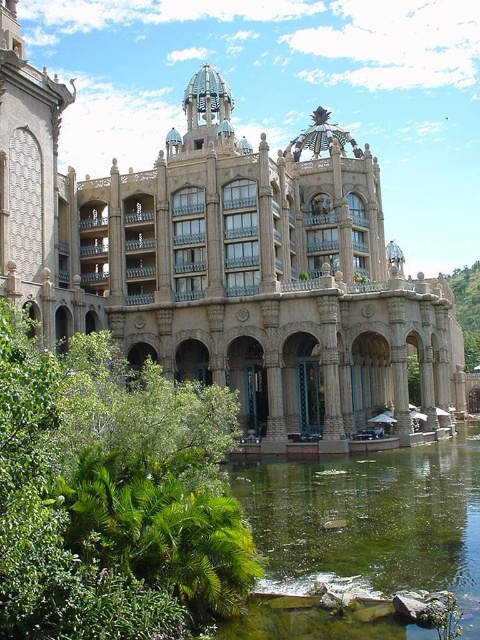
Which of these two, green leafy bush at lower left or green mossy pond at lower center, stands taller?

With more height is green leafy bush at lower left.

Is green leafy bush at lower left further to camera compared to green mossy pond at lower center?

No, it is in front of green mossy pond at lower center.

Which is behind, point (31, 576) or point (252, 616)?

The point (252, 616) is more distant.

In order to click on green leafy bush at lower left in this screenshot , I will do click(x=112, y=496).

Between point (101, 253) and point (208, 612), which one is positioned behind?

The point (101, 253) is behind.

The image size is (480, 640). In order to click on beige stone palace at center in this screenshot , I will do `click(228, 266)`.

What do you see at coordinates (228, 266) in the screenshot? The width and height of the screenshot is (480, 640). I see `beige stone palace at center` at bounding box center [228, 266].

Find the location of a particular element. The width and height of the screenshot is (480, 640). beige stone palace at center is located at coordinates (228, 266).

From the picture: Does beige stone palace at center appear under green mossy pond at lower center?

Actually, beige stone palace at center is above green mossy pond at lower center.

Which is more to the right, beige stone palace at center or green mossy pond at lower center?

Positioned to the right is green mossy pond at lower center.

This screenshot has height=640, width=480. What do you see at coordinates (228, 266) in the screenshot? I see `beige stone palace at center` at bounding box center [228, 266].

The height and width of the screenshot is (640, 480). I want to click on beige stone palace at center, so click(x=228, y=266).